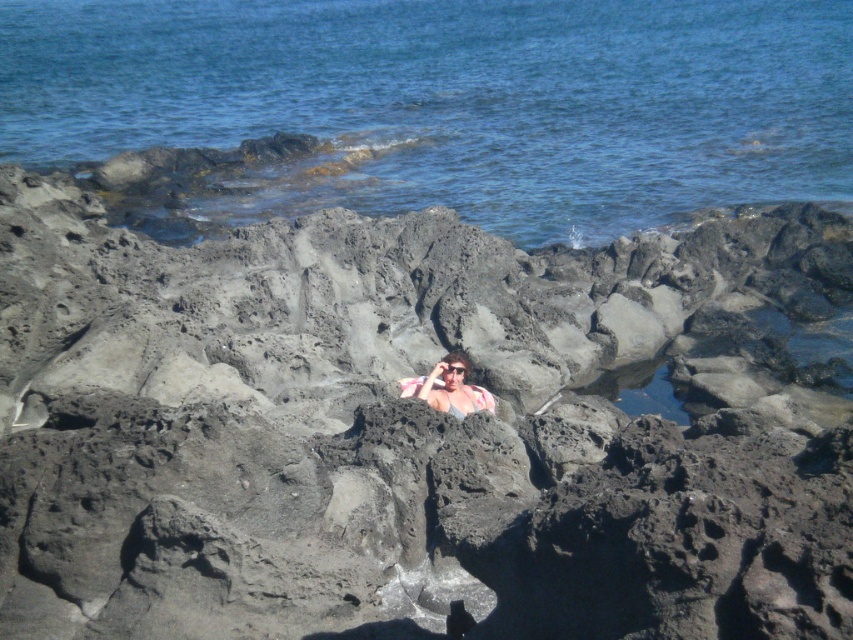
Is blue water at center shorter than pink fabric at center?

In fact, blue water at center may be taller than pink fabric at center.

Can you confirm if blue water at center is positioned to the right of pink fabric at center?

Correct, you'll find blue water at center to the right of pink fabric at center.

Is point (509, 90) less distant than point (448, 387)?

No.

Locate an element on the screen. This screenshot has width=853, height=640. blue water at center is located at coordinates (451, 102).

Is black rough rock at center behind pink fabric at center?

No, it is in front of pink fabric at center.

Consider the image. Can you confirm if black rough rock at center is positioned below pink fabric at center?

Yes.

At what (x,y) coordinates should I click in order to perform the action: click on black rough rock at center. Please return your answer as a coordinate pair (x, y). The height and width of the screenshot is (640, 853). Looking at the image, I should click on (412, 428).

Can you confirm if black rough rock at center is positioned to the right of blue water at center?

Correct, you'll find black rough rock at center to the right of blue water at center.

Is black rough rock at center bigger than blue water at center?

No, black rough rock at center is not bigger than blue water at center.

Where is `black rough rock at center`? The image size is (853, 640). black rough rock at center is located at coordinates tap(412, 428).

Where is `black rough rock at center`? black rough rock at center is located at coordinates (412, 428).